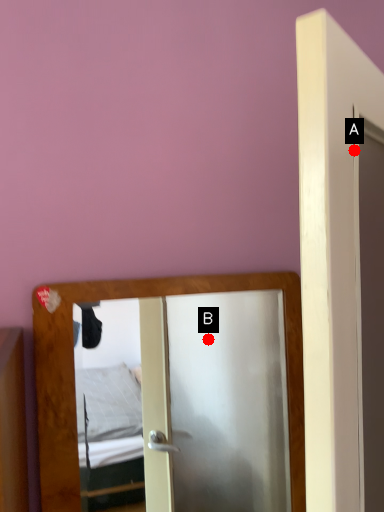
Question: Two points are circled on the image, labeled by A and B beside each circle. Which point is closer to the camera?

Choices:
 (A) A is closer
 (B) B is closer

Answer: (A)